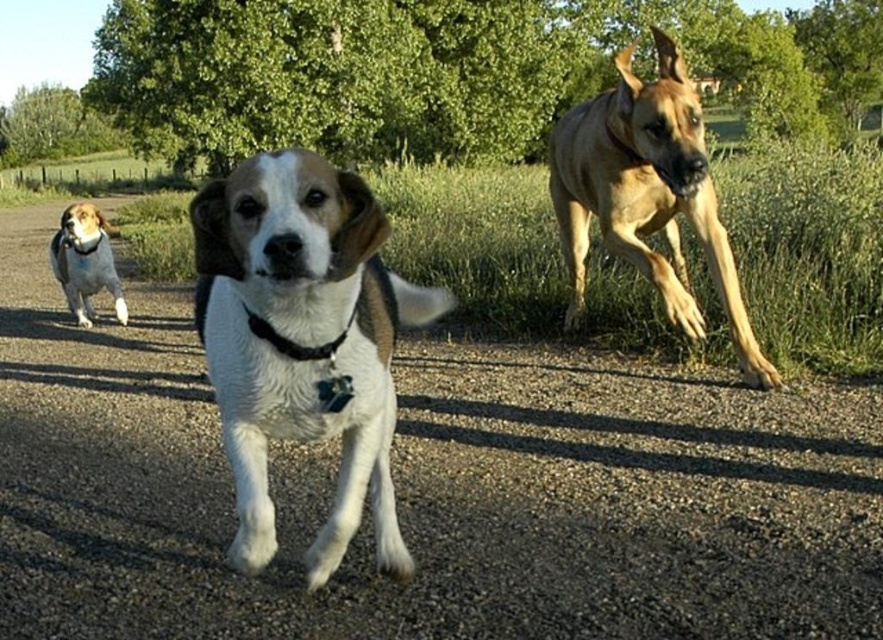
Locate an element on the screen. white fur dog at center is located at coordinates (303, 340).

Is white fur dog at center smaller than golden tan fur at right?

Yes.

What are the coordinates of `white fur dog at center` in the screenshot? It's located at (303, 340).

Is golden tan fur at right taller than black leather neckband at center?

Yes.

Can you confirm if golden tan fur at right is wider than black leather neckband at center?

Yes, golden tan fur at right is wider than black leather neckband at center.

This screenshot has width=883, height=640. Describe the element at coordinates (646, 195) in the screenshot. I see `golden tan fur at right` at that location.

The image size is (883, 640). What are the coordinates of `golden tan fur at right` in the screenshot? It's located at (646, 195).

Between white fur dog at left and black leather neckband at center, which one is positioned higher?

Positioned higher is white fur dog at left.

Does white fur dog at left appear on the right side of black leather neckband at center?

Incorrect, white fur dog at left is not on the right side of black leather neckband at center.

Does point (78, 320) lie behind point (262, 321)?

Yes, it is behind point (262, 321).

I want to click on white fur dog at left, so click(x=85, y=262).